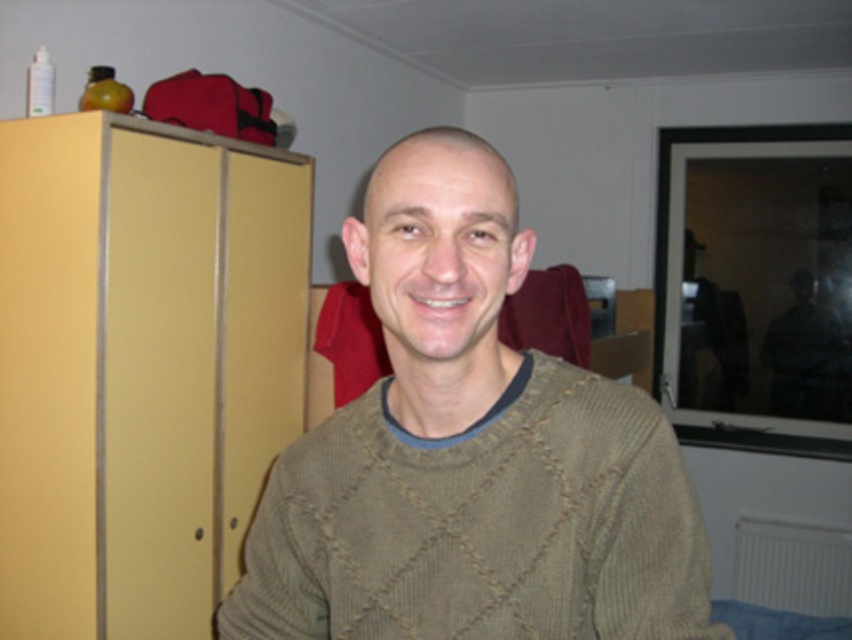
You are an interior designer assessing the room layout. You need to determine if the knitted olive sweater at center can be placed on top of the matte yellow cabinet at left without exceeding its height. What is your recommendation?

The knitted olive sweater at center is shorter than the matte yellow cabinet at left, so it can be placed on top of it without exceeding its height.

You are standing in the room shown in the image and want to place a small decoration between the two points labeled point (393, 333) and point (50, 262). Based on their positions, which point is closer to you where you should start placing the decoration?

Point (393, 333) is closer to the viewer than point (50, 262), so you should start placing the decoration near point (393, 333) first.